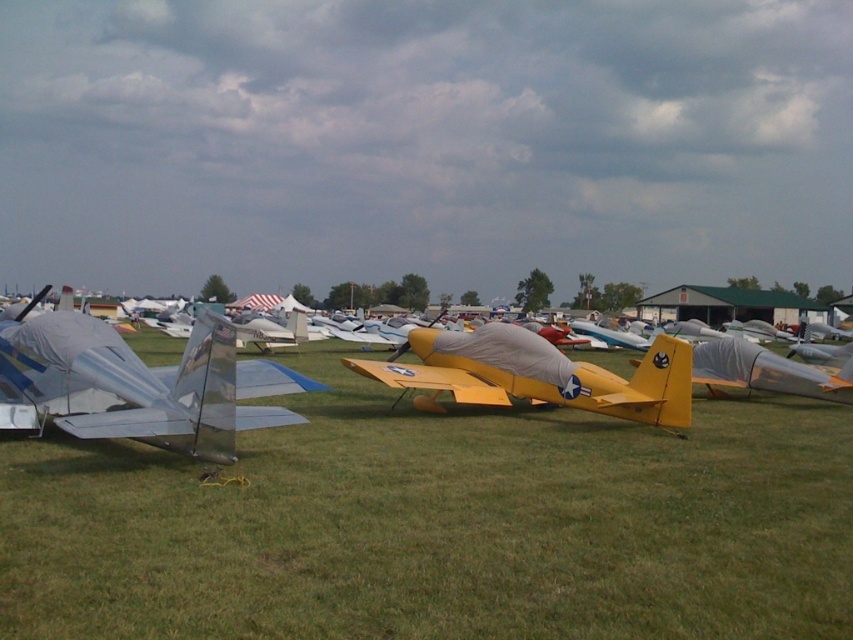
You are a photographer planning to take a photo of the shiny silver airplane at left and the green grass at center. Based on their sizes in the image, which object should you focus on first if you want to ensure both are in frame without moving the camera?

The green grass at center is smaller than the shiny silver airplane at left, so you should focus on the shiny silver airplane at left first since it occupies more space in the frame, ensuring it is properly centered before adjusting for the smaller green grass at center.

You are standing at the point marked as point (136, 384). Which object is exactly at your current location?

The metallic silver airplane at center is located at point (136, 384).

You are a photographer standing on the green grass at center and want to take a photo of the shiny silver airplane at left. Can you see the entire airplane without any obstruction?

The green grass at center is positioned under the shiny silver airplane at left, so the grass is directly below the airplane. Since you are standing on the grass, you can see the entire airplane without obstruction as it is elevated above you.